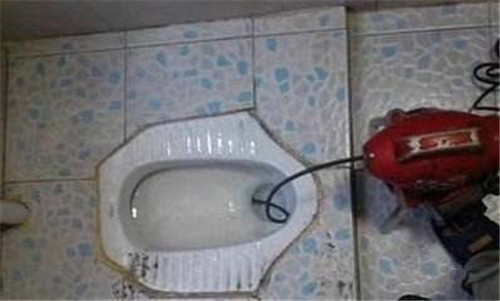
Image resolution: width=500 pixels, height=301 pixels. I want to click on grout, so click(222, 39), click(129, 49), click(125, 99), click(77, 177).